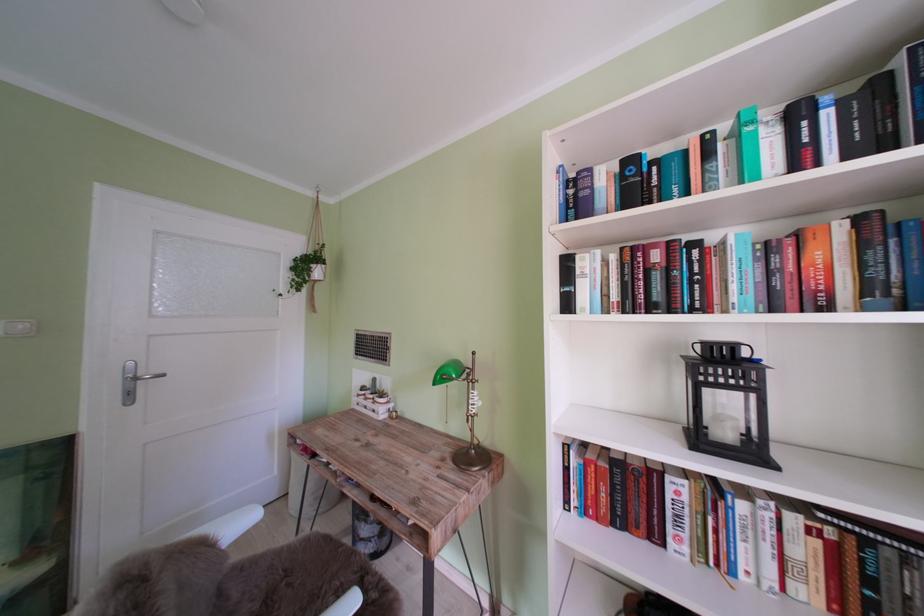
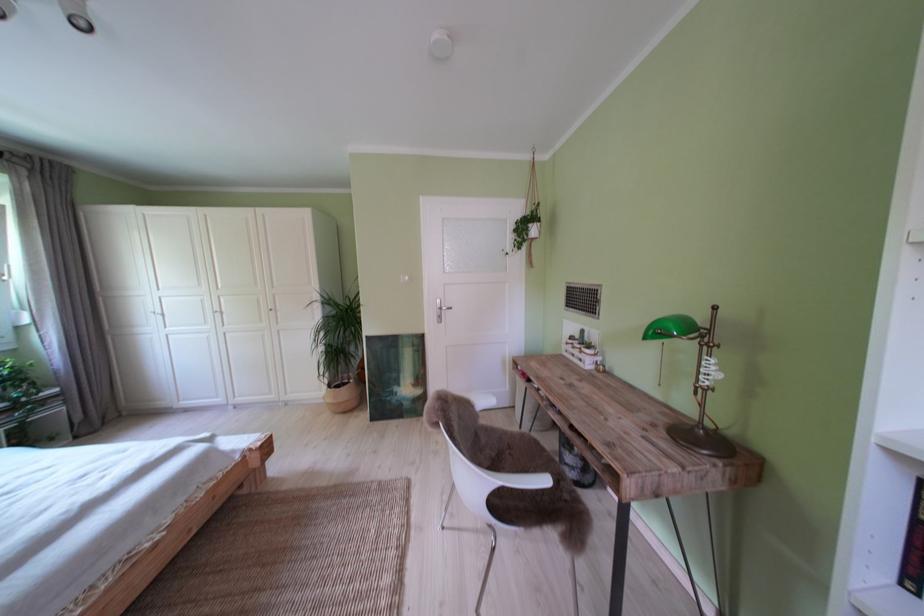
Find the pixel in the second image that matches (441,411) in the first image.

(652, 371)